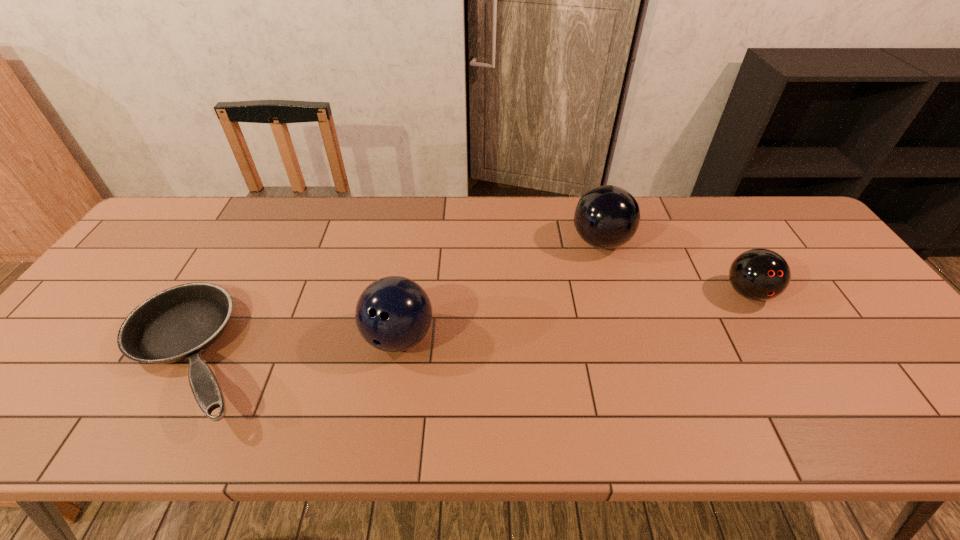
Locate an element on the screen. This screenshot has width=960, height=540. free space that is in between the third object from left to right and the shortest bowling ball is located at coordinates (674, 267).

This screenshot has height=540, width=960. What are the coordinates of `blank region between the second bowling ball from left to right and the second object from left to right` in the screenshot? It's located at (500, 289).

This screenshot has width=960, height=540. What are the coordinates of `free spot between the shortest object and the third object from right to left` in the screenshot? It's located at tap(296, 346).

Where is `vacant space that's between the shortest bowling ball and the leftmost bowling ball`? Image resolution: width=960 pixels, height=540 pixels. vacant space that's between the shortest bowling ball and the leftmost bowling ball is located at coordinates (573, 315).

Locate an element on the screen. Image resolution: width=960 pixels, height=540 pixels. unoccupied area between the third tallest object and the shortest object is located at coordinates (470, 324).

Locate an element on the screen. Image resolution: width=960 pixels, height=540 pixels. unoccupied position between the third object from left to right and the rightmost object is located at coordinates (674, 267).

Find the location of a particular element. the second closest object relative to the shortest bowling ball is located at coordinates (394, 313).

Identify the location of object that can be found as the third closest to the leftmost bowling ball. This screenshot has width=960, height=540. (759, 274).

Image resolution: width=960 pixels, height=540 pixels. I want to click on bowling ball that is the second closest one to the frying pan, so click(606, 217).

Image resolution: width=960 pixels, height=540 pixels. What are the coordinates of `bowling ball identified as the second closest to the frying pan` in the screenshot? It's located at (606, 217).